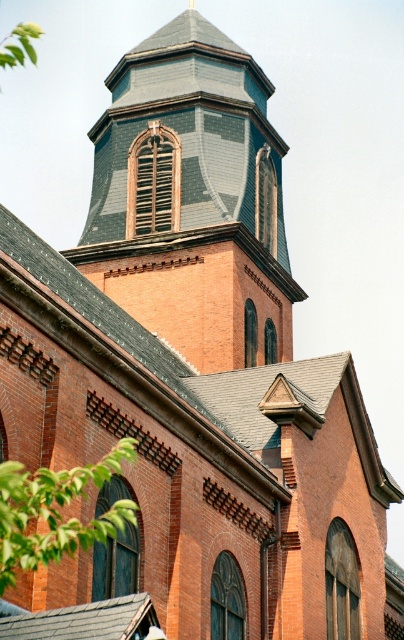
You are standing in front of the historic brick church and want to take a photo that includes both the gray slate roof at upper center and the green leafy tree at lower left. Which object should you position closer to the top of your camera frame?

The gray slate roof at upper center should be positioned closer to the top of your camera frame because it is located above the green leafy tree at lower left.

You are standing in front of the church and notice the gray slate roof at upper center and the green leafy tree at lower left. From your perspective, which object is positioned to the right of the other?

The gray slate roof at upper center is positioned to the right of the green leafy tree at lower left.

What is located at the point with coordinates (191, 196) in the image?

The gray slate roof at upper center is located at the point with coordinates (191, 196).